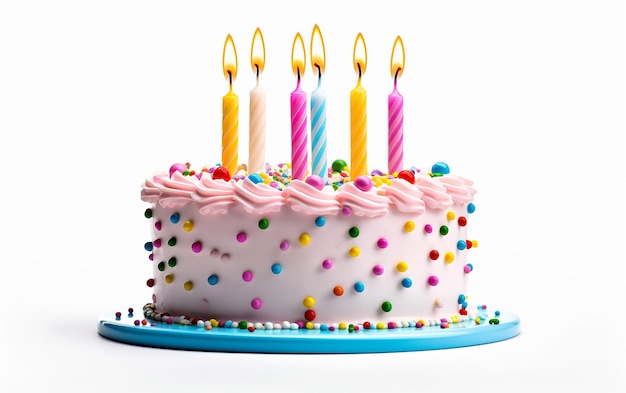
The height and width of the screenshot is (393, 626). Find the location of `birthday candles`. birthday candles is located at coordinates (226, 52), (258, 53), (298, 54), (317, 54), (357, 53), (398, 53).